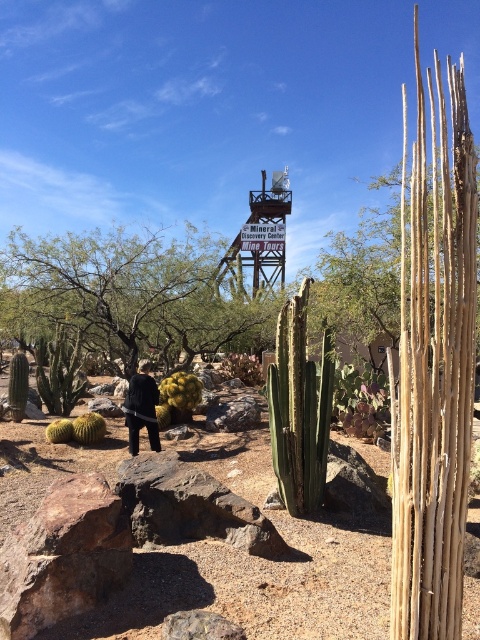
Describe the element at coordinates (142, 408) in the screenshot. I see `black matte jacket at center` at that location.

Is point (139, 396) closer to camera compared to point (49, 435)?

Yes, point (139, 396) is closer to viewer.

Identify the location of black matte jacket at center. [142, 408].

I want to click on black matte jacket at center, so click(142, 408).

Who is more forward, (134, 404) or (87, 444)?

Point (134, 404)

Locate an element on the screen. black matte jacket at center is located at coordinates (142, 408).

Is green spiny cactus at lower left wider than green fuzzy cactus at lower left?

Yes, green spiny cactus at lower left is wider than green fuzzy cactus at lower left.

Can you confirm if green spiny cactus at lower left is shorter than green fuzzy cactus at lower left?

No.

This screenshot has width=480, height=640. I want to click on green spiny cactus at lower left, so click(88, 428).